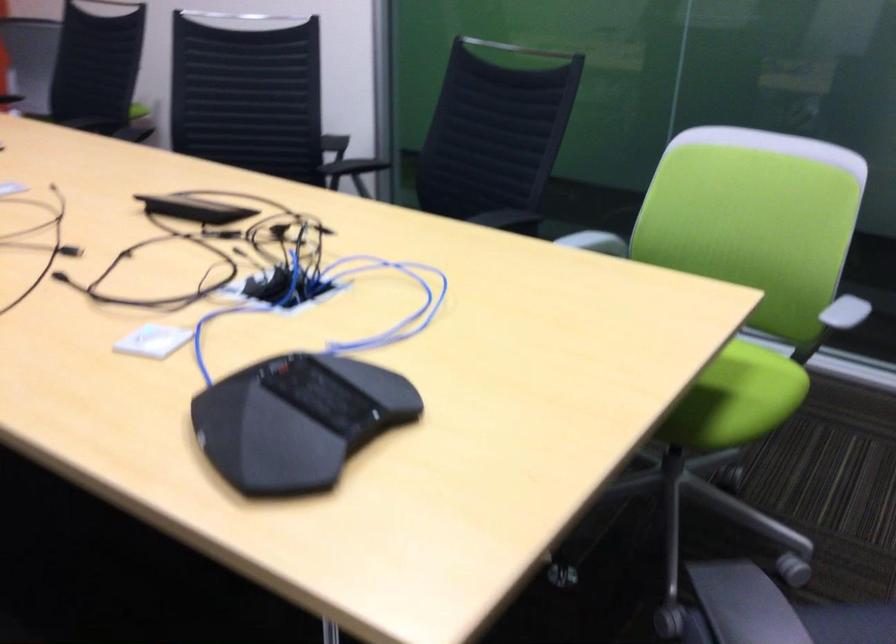
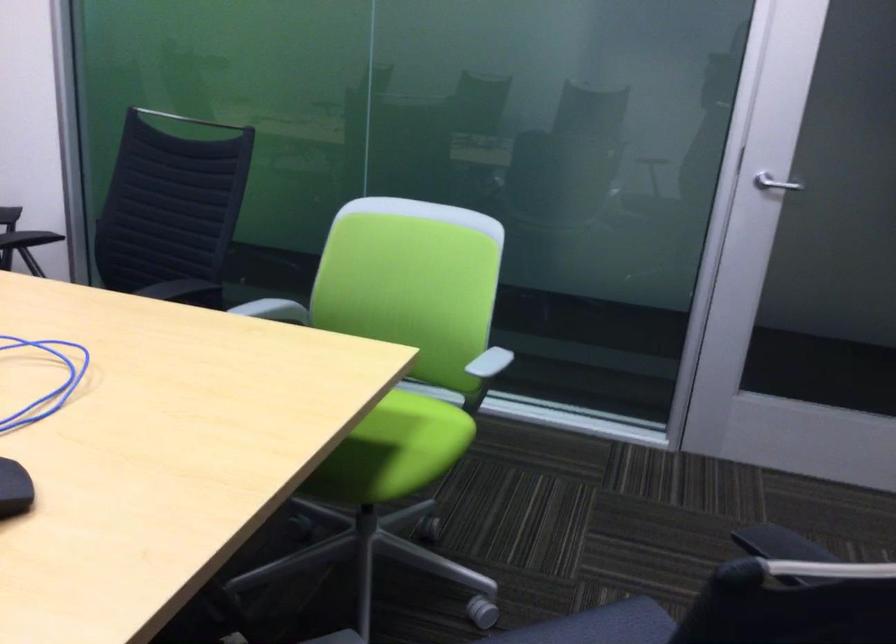
Question: Based on the continuous images, in which direction is the camera rotating? Reply with the corresponding letter.

Choices:
 (A) Left
 (B) Right
 (C) Up
 (D) Down

Answer: (B)